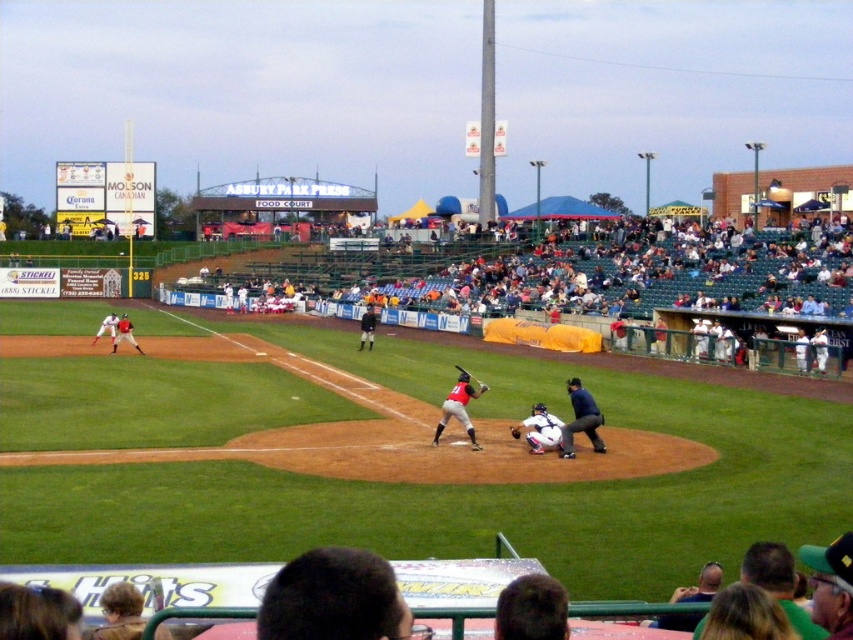
Is point (109, 320) behind point (517, 426)?

Yes.

Is matte white uniform at left to the left of brown leather glove at center from the viewer's perspective?

Correct, you'll find matte white uniform at left to the left of brown leather glove at center.

Describe the element at coordinates (107, 326) in the screenshot. I see `matte white uniform at left` at that location.

Where is `matte white uniform at left`? This screenshot has height=640, width=853. matte white uniform at left is located at coordinates (107, 326).

Can you confirm if white plastic seats at center is positioned below white matte catcher at center?

Incorrect, white plastic seats at center is not positioned below white matte catcher at center.

Between point (718, 310) and point (538, 449), which one is positioned behind?

The point (718, 310) is more distant.

Which is behind, point (833, 259) or point (537, 420)?

The point (833, 259) is more distant.

Where is `white plastic seats at center`? white plastic seats at center is located at coordinates (607, 285).

Is blue fabric umpire at center positioned in front of dark brown leather glove at center?

Yes, blue fabric umpire at center is in front of dark brown leather glove at center.

Who is positioned more to the left, blue fabric umpire at center or dark brown leather glove at center?

Positioned to the left is dark brown leather glove at center.

Is point (575, 419) in front of point (480, 385)?

Yes, point (575, 419) is closer to viewer.

You are a GUI agent. You are given a task and a screenshot of the screen. Output one action in this format:
    pyautogui.click(x=<x>, y=<y>)
    Task: Click on the blue fabric umpire at center
    
    Given the screenshot: What is the action you would take?
    pyautogui.click(x=581, y=419)